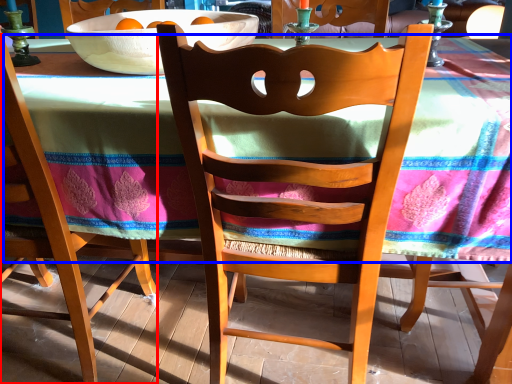
Question: Which object appears farthest to the camera in this image, chair (highlighted by a red box) or tablecloth (highlighted by a blue box)?

Choices:
 (A) chair
 (B) tablecloth

Answer: (A)